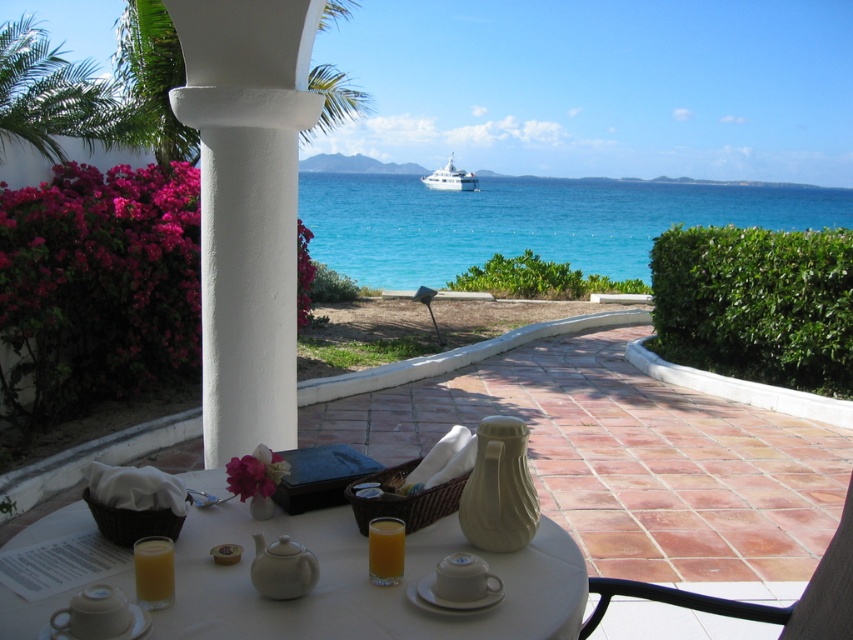
You are a waiter setting up the table and need to pour orange juice from a pitcher into the orange translucent glass at lower left. The orange liquid at center is already in the glass. Can you fit more orange juice into the glass without spilling?

The orange translucent glass at lower left might be wider than the orange liquid at center, so there might be enough space to add more orange juice without spilling, but it depends on the current volume of the orange liquid at center.

You are a guest at this coastal patio and want to pour the orange liquid at center into the white glossy yacht at center. Based on their sizes, will the liquid fit entirely into the yacht?

The orange liquid at center occupies less space than the white glossy yacht at center, so pouring the entire liquid into the yacht should be possible as it can accommodate the volume.

You are a waiter at this coastal patio and need to pour more orange juice into the orange liquid at center from the orange translucent glass at lower left. Is the glass big enough to hold the remaining juice after pouring?

The orange translucent glass at lower left is larger in size than orange liquid at center, so yes, the glass can hold the remaining juice after pouring.